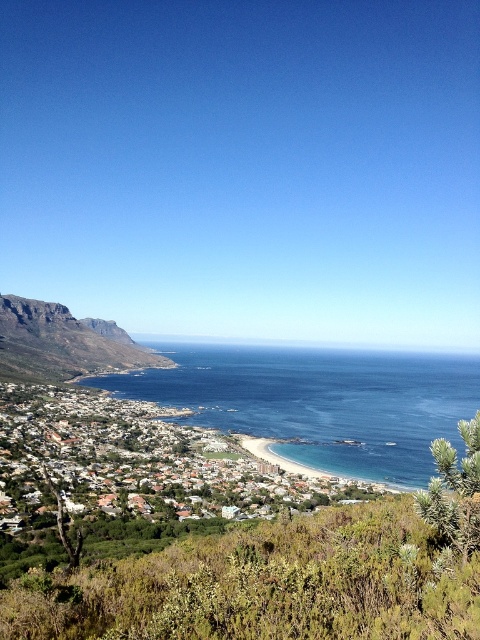
Is white matte houses at center behind rugged stone mountain at left?

No.

Is point (247, 502) less distant than point (74, 342)?

Yes, it is.

Does point (369, 497) lie behind point (57, 356)?

No, it is in front of (57, 356).

Identify the location of white matte houses at center. (x=137, y=461).

Can you confirm if blue water at center is positioned to the left of rugged stone mountain at left?

Incorrect, blue water at center is not on the left side of rugged stone mountain at left.

Can you confirm if blue water at center is shorter than rugged stone mountain at left?

Yes, blue water at center is shorter than rugged stone mountain at left.

Measure the distance between blue water at center and camera.

The distance of blue water at center from camera is 124.75 feet.

Identify the location of blue water at center. The height and width of the screenshot is (640, 480). (320, 401).

Is blue water at center above white matte houses at center?

Indeed, blue water at center is positioned over white matte houses at center.

Who is taller, blue water at center or white matte houses at center?

blue water at center is taller.

Locate an element on the screen. Image resolution: width=480 pixels, height=640 pixels. blue water at center is located at coordinates (320, 401).